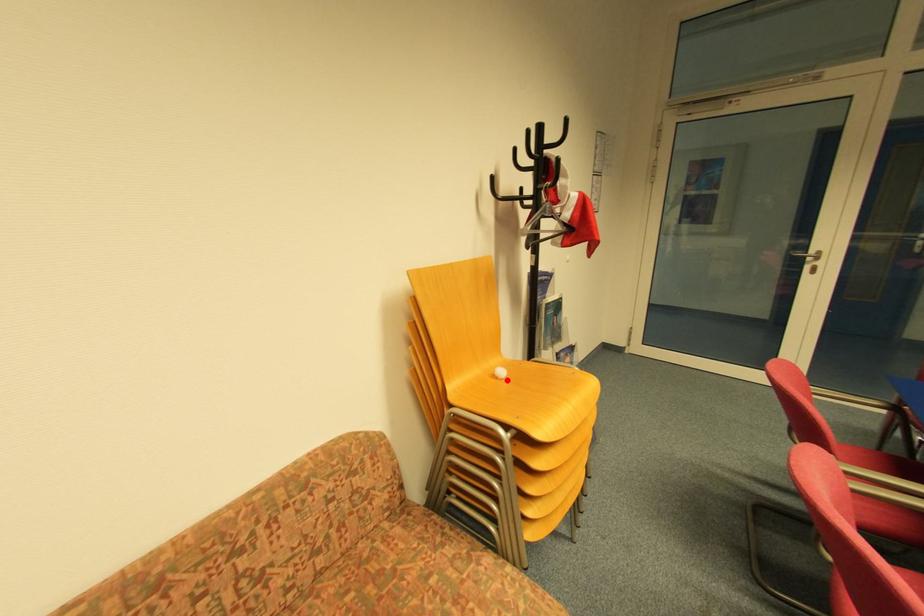
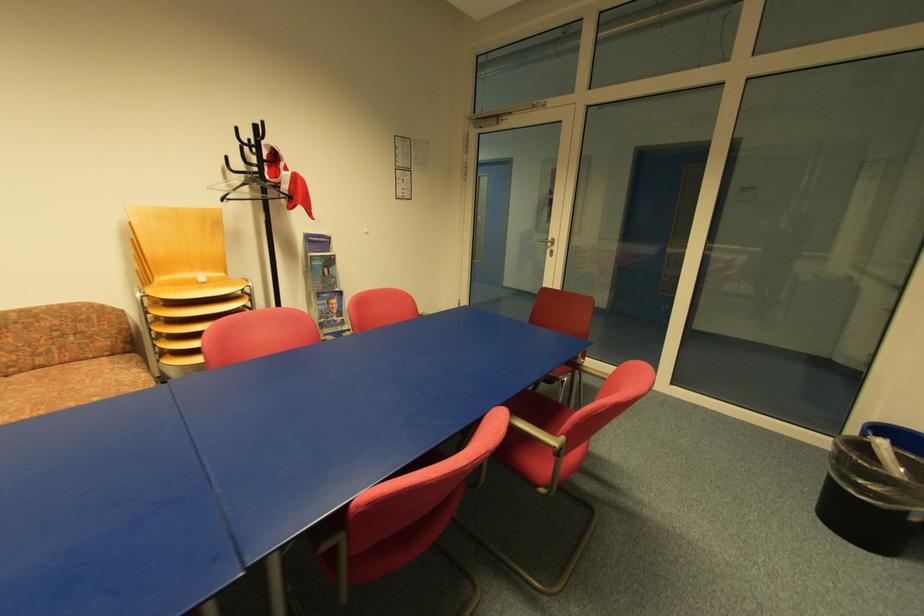
In the second image, find the point that corresponds to the highlighted location in the first image.

(207, 285)